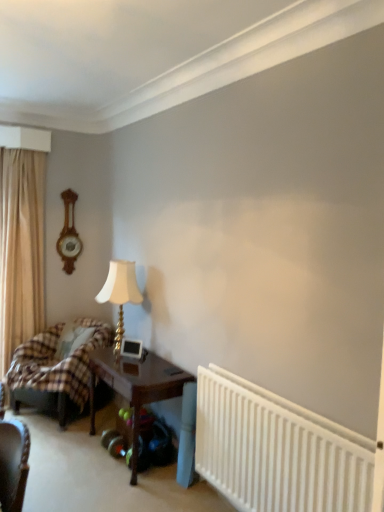
Locate an element on the screen. Image resolution: width=384 pixels, height=512 pixels. free point above white plastic radiator at lower right (from a real-world perspective) is located at coordinates (296, 393).